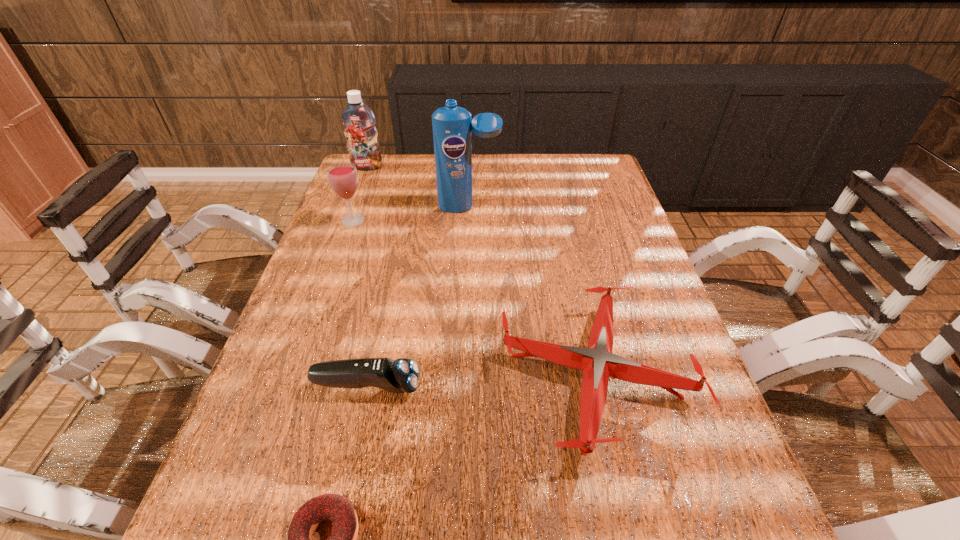
Where is `free region located 0.220m on the back of the drone`? The height and width of the screenshot is (540, 960). free region located 0.220m on the back of the drone is located at coordinates (566, 251).

Locate an element on the screen. vacant space located 0.280m on the head of the electric shaver is located at coordinates (558, 386).

Identify the location of object that is at the far edge. This screenshot has width=960, height=540. (358, 120).

This screenshot has height=540, width=960. Find the location of `shampoo situated at the left edge`. shampoo situated at the left edge is located at coordinates (358, 120).

Where is `wineglass that is at the left edge`? wineglass that is at the left edge is located at coordinates (343, 178).

You are a GUI agent. You are given a task and a screenshot of the screen. Output one action in this format:
    pyautogui.click(x=<x>, y=<y>)
    Task: Click on the electric shaver positioned at the left edge
    
    Given the screenshot: What is the action you would take?
    point(401,375)

The height and width of the screenshot is (540, 960). Find the location of `object located in the right edge section of the desktop`. object located in the right edge section of the desktop is located at coordinates coord(598,363).

What are the coordinates of `object positioned at the far left corner` in the screenshot? It's located at (358, 120).

Where is `vacant region at the near edge of the desktop`? The image size is (960, 540). vacant region at the near edge of the desktop is located at coordinates (324, 522).

Identify the location of free space at the left edge of the desktop. The height and width of the screenshot is (540, 960). (337, 393).